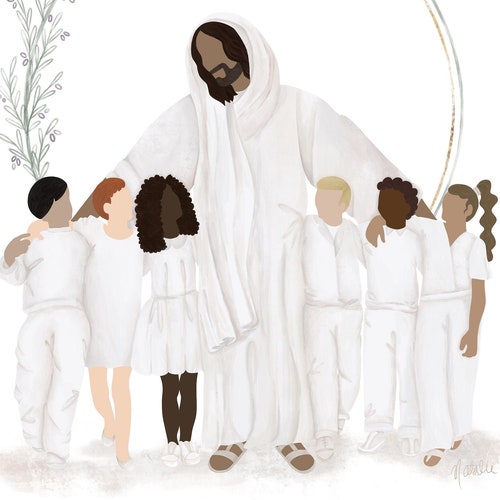
Locate an element on the screen. dark brown legs is located at coordinates (173, 419), (188, 417).